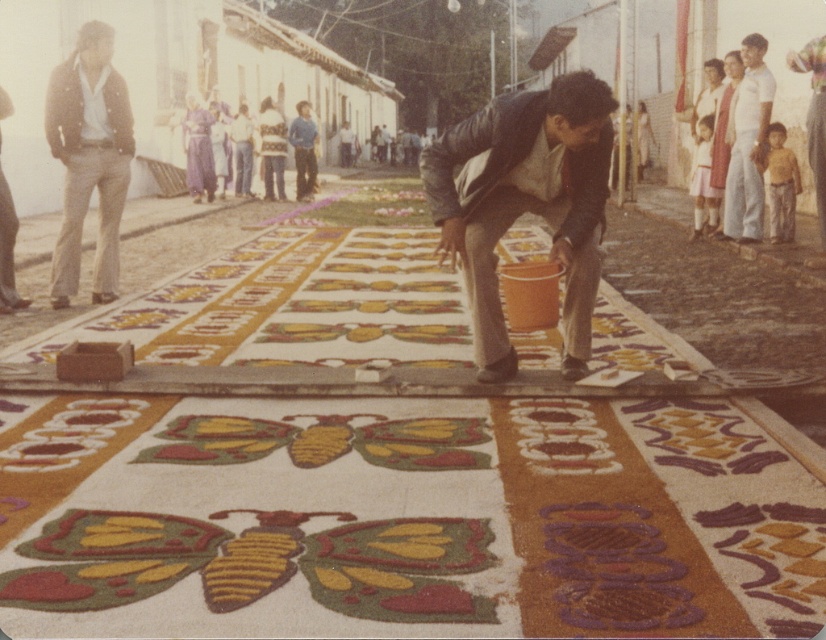
Question: Does multicolored sand art at center appear on the right side of light brown denim pants at left?

Choices:
 (A) yes
 (B) no

Answer: (A)

Question: From the image, what is the correct spatial relationship of multicolored sand art at center in relation to light brown denim pants at left?

Choices:
 (A) left
 (B) right

Answer: (B)

Question: Among these points, which one is nearest to the camera?

Choices:
 (A) (563, 120)
 (B) (812, 572)

Answer: (B)

Question: Is multicolored sand art at center closer to the viewer compared to matte black jacket at center?

Choices:
 (A) yes
 (B) no

Answer: (A)

Question: Which object appears closest to the camera in this image?

Choices:
 (A) matte black jacket at center
 (B) light brown denim pants at left
 (C) multicolored sand art at center

Answer: (C)

Question: Which is nearer to the light brown denim pants at left?

Choices:
 (A) matte black jacket at center
 (B) multicolored sand art at center

Answer: (A)